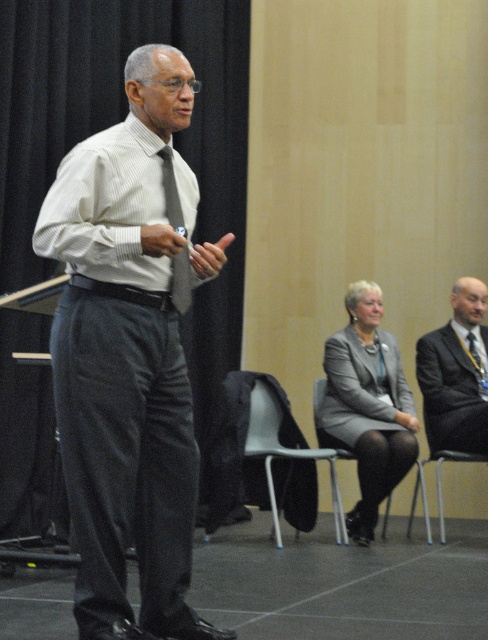
Based on the scene description, where exactly is the matte gray shirt at center located in terms of coordinates?

The matte gray shirt at center is located at point (126, 358).

You are an event planner arranging seating for a panel discussion. You have a metallic gray chair at center and a dark gray suit at right. Which object is shorter in height?

The metallic gray chair at center is shorter in height than the dark gray suit at right.